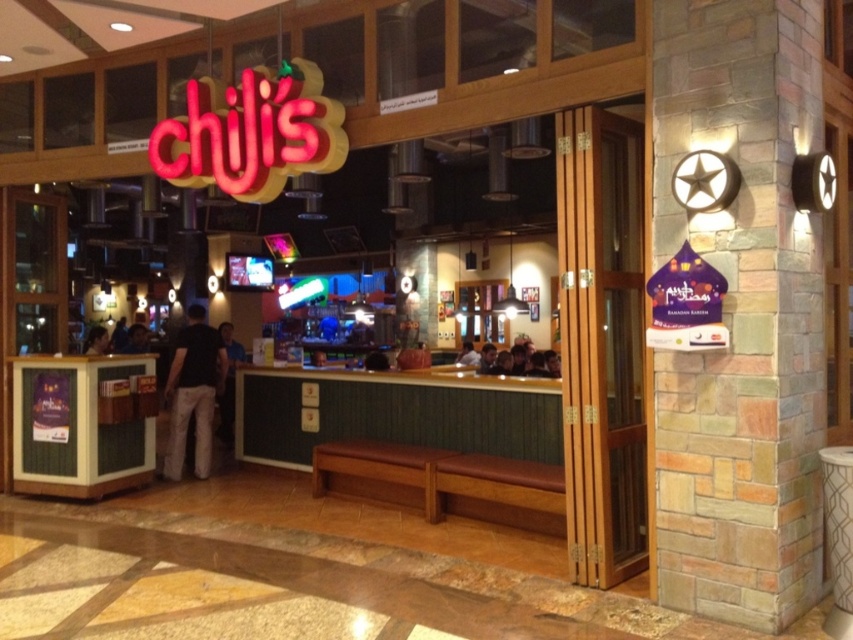
Question: Estimate the real-world distances between objects in this image. Which object is farther from the black shirt at left?

Choices:
 (A) black cotton pants at center
 (B) wooden door at center

Answer: (B)

Question: Observing the image, what is the correct spatial positioning of black cotton pants at center in reference to black shirt at left?

Choices:
 (A) below
 (B) above

Answer: (A)

Question: Which object is closer to the camera taking this photo?

Choices:
 (A) black shirt at left
 (B) wooden door at center

Answer: (B)

Question: Is black cotton pants at center further to camera compared to black shirt at left?

Choices:
 (A) yes
 (B) no

Answer: (B)

Question: Which of the following is the closest to the observer?

Choices:
 (A) black shirt at left
 (B) wooden door at center

Answer: (B)

Question: Does black cotton pants at center appear on the left side of black shirt at left?

Choices:
 (A) yes
 (B) no

Answer: (B)